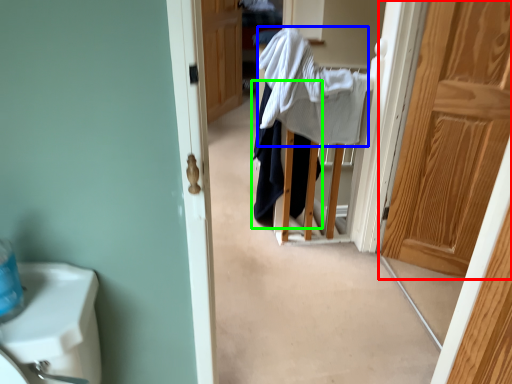
Question: Which object is the farthest from door (highlighted by a red box)? Choose among these: bath towel (highlighted by a blue box) or clothing (highlighted by a green box).

Choices:
 (A) bath towel
 (B) clothing

Answer: (B)